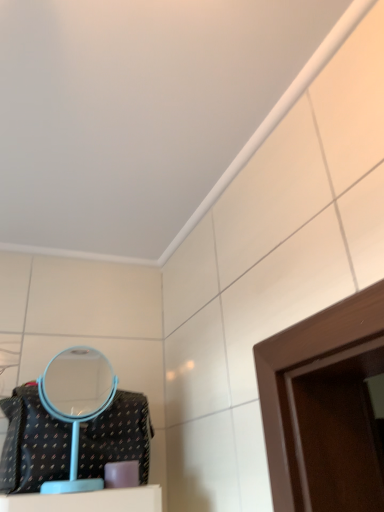
Question: Is light blue plastic mirror at lower left inside the boundaries of black textured fabric bag at lower left, or outside?

Choices:
 (A) inside
 (B) outside

Answer: (B)

Question: From their relative heights in the image, would you say light blue plastic mirror at lower left is taller or shorter than black textured fabric bag at lower left?

Choices:
 (A) tall
 (B) short

Answer: (A)

Question: Looking at their shapes, would you say light blue plastic mirror at lower left is wider or thinner than black textured fabric bag at lower left?

Choices:
 (A) thin
 (B) wide

Answer: (A)

Question: From the image's perspective, is black textured fabric bag at lower left positioned above or below light blue plastic mirror at lower left?

Choices:
 (A) below
 (B) above

Answer: (A)

Question: Which is correct: black textured fabric bag at lower left is inside light blue plastic mirror at lower left, or outside of it?

Choices:
 (A) inside
 (B) outside

Answer: (B)

Question: From a real-world perspective, is black textured fabric bag at lower left positioned above or below light blue plastic mirror at lower left?

Choices:
 (A) above
 (B) below

Answer: (B)

Question: In terms of height, does black textured fabric bag at lower left look taller or shorter compared to light blue plastic mirror at lower left?

Choices:
 (A) tall
 (B) short

Answer: (B)